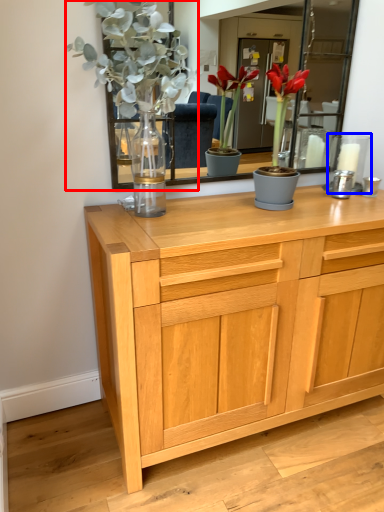
Question: Among these objects, which one is nearest to the camera, floral arrangement (highlighted by a red box) or candle holder (highlighted by a blue box)?

Choices:
 (A) floral arrangement
 (B) candle holder

Answer: (A)